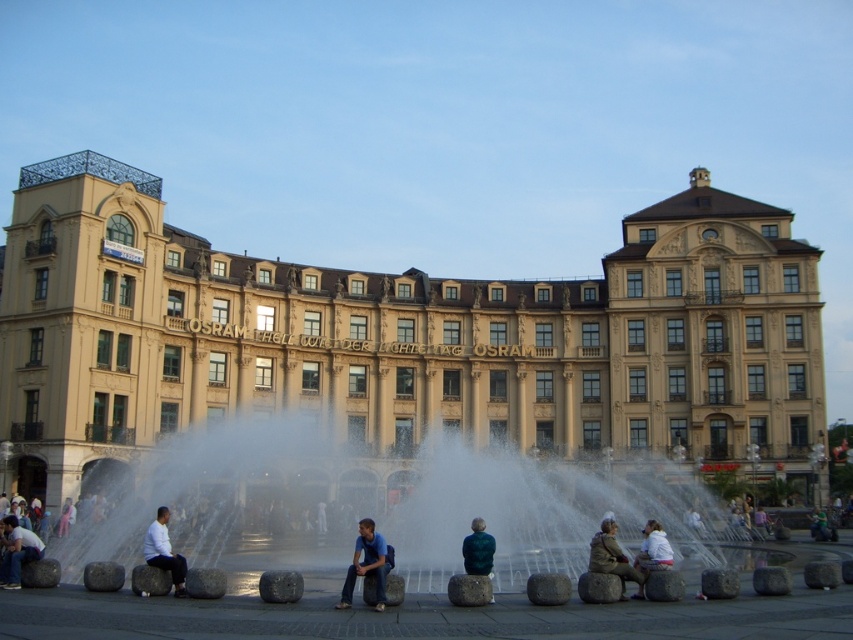
Is beige stone building at center wider than white cotton shirt at lower left?

Yes, beige stone building at center is wider than white cotton shirt at lower left.

Can you confirm if beige stone building at center is shorter than white cotton shirt at lower left?

No.

Image resolution: width=853 pixels, height=640 pixels. In order to click on beige stone building at center in this screenshot , I will do `click(403, 339)`.

The width and height of the screenshot is (853, 640). I want to click on beige stone building at center, so click(403, 339).

Is point (20, 552) positioned in front of point (155, 548)?

No.

Based on the photo, how far apart are white cotton shirt at lower left and white matte shirt at lower left?

The distance of white cotton shirt at lower left from white matte shirt at lower left is 8.74 meters.

Who is more forward, [19,532] or [160,563]?

Point [160,563] is more forward.

At what (x,y) coordinates should I click in order to perform the action: click on white cotton shirt at lower left. Please return your answer as a coordinate pair (x, y). Looking at the image, I should click on (16, 552).

Is point (360, 536) closer to camera compared to point (490, 534)?

That is True.

Is blue denim jeans at center to the left of teal fabric jacket at center from the viewer's perspective?

Indeed, blue denim jeans at center is positioned on the left side of teal fabric jacket at center.

Which is in front, point (349, 572) or point (476, 560)?

Point (349, 572) is in front.

Locate an element on the screen. The image size is (853, 640). blue denim jeans at center is located at coordinates (368, 564).